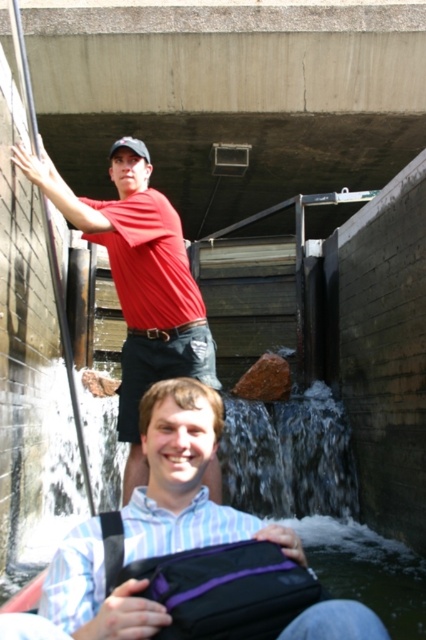
Is clear water at center wider than matte red shirt at upper left?

Correct, the width of clear water at center exceeds that of matte red shirt at upper left.

Is point (290, 493) behind point (150, 339)?

Yes, it is.

The image size is (426, 640). Identify the location of clear water at center. (319, 500).

Which is behind, point (264, 483) or point (123, 136)?

Positioned behind is point (123, 136).

Image resolution: width=426 pixels, height=640 pixels. Describe the element at coordinates (319, 500) in the screenshot. I see `clear water at center` at that location.

Locate an element on the screen. The width and height of the screenshot is (426, 640). clear water at center is located at coordinates (319, 500).

At what (x,y) coordinates should I click in order to perform the action: click on clear water at center. Please return your answer as a coordinate pair (x, y). Image resolution: width=426 pixels, height=640 pixels. Looking at the image, I should click on (319, 500).

Can you confirm if striped cotton shirt at lower center is shorter than matte black baseball cap at upper center?

Indeed, striped cotton shirt at lower center has a lesser height compared to matte black baseball cap at upper center.

Does striped cotton shirt at lower center appear over matte black baseball cap at upper center?

Actually, striped cotton shirt at lower center is below matte black baseball cap at upper center.

Which is behind, point (175, 548) or point (144, 156)?

The point (144, 156) is behind.

Find the location of `striped cotton shirt at lower center`. striped cotton shirt at lower center is located at coordinates (181, 525).